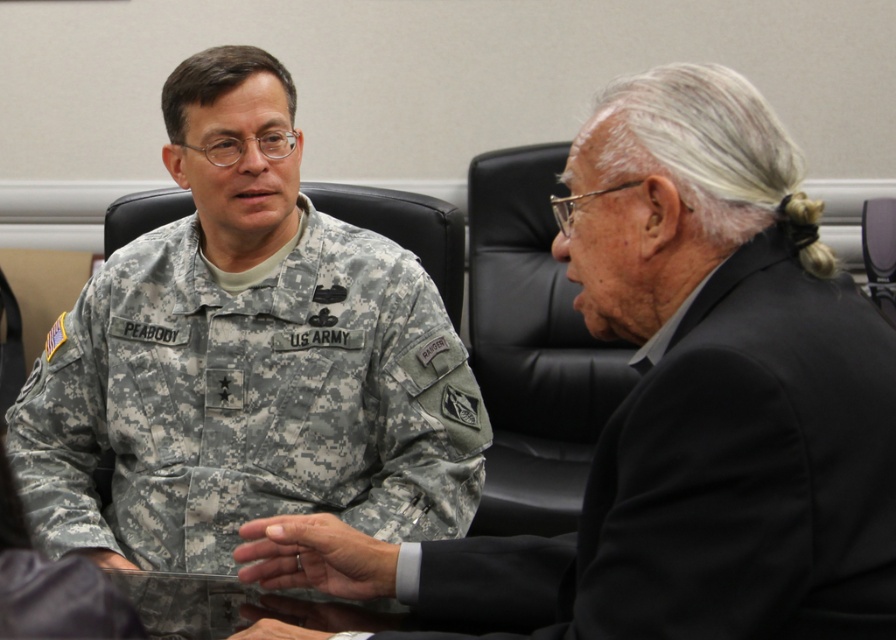
You are an interior designer assessing the placement of furniture in a room. You notice the black matte suit at right. Where is it positioned in the room?

The black matte suit at right is located at point (x=714, y=483) in the room.

Looking at this image, you are a photographer setting up a shot of the two people in the scene. You need to position a spotlight so that it illuminates the camouflage fabric at center without shining directly on the matte black hand at center. Based on their positions, is this possible?

The camouflage fabric at center is to the right of the matte black hand at center, so positioning the spotlight to the right side of the hand would illuminate the fabric without affecting the hand.

You are an interior designer assessing the layout of this office. You notice the camouflage fabric at center and the matte black hand at center. Which object occupies a higher position in the image?

The camouflage fabric at center is taller than the matte black hand at center, so the camouflage fabric at center occupies a higher position in the image.